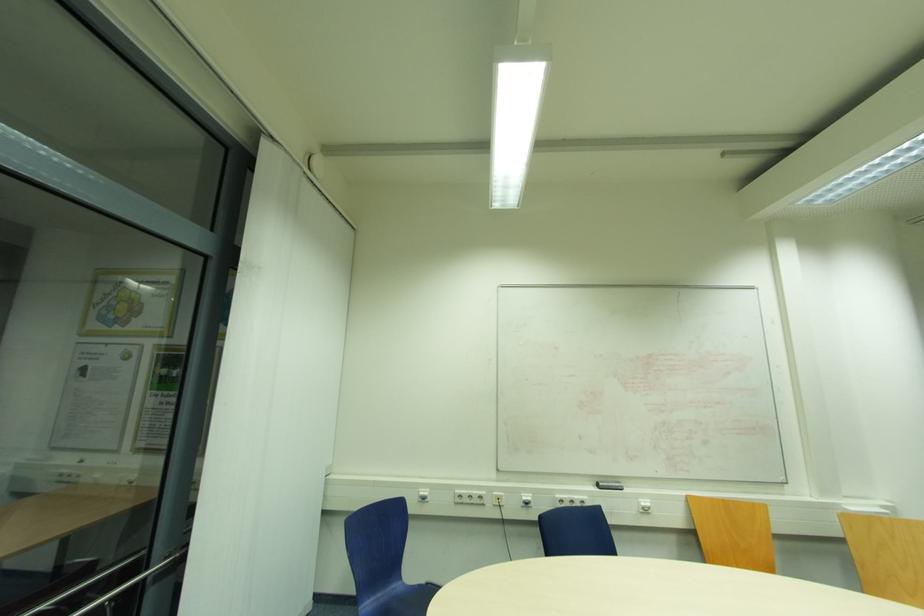
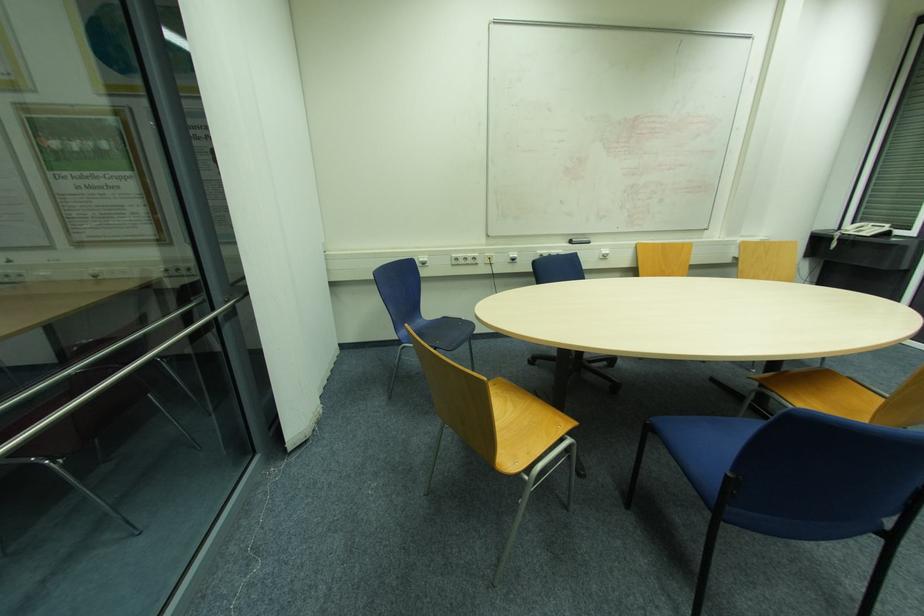
Where in the second image is the point corresponding to point (645, 505) from the first image?

(604, 253)